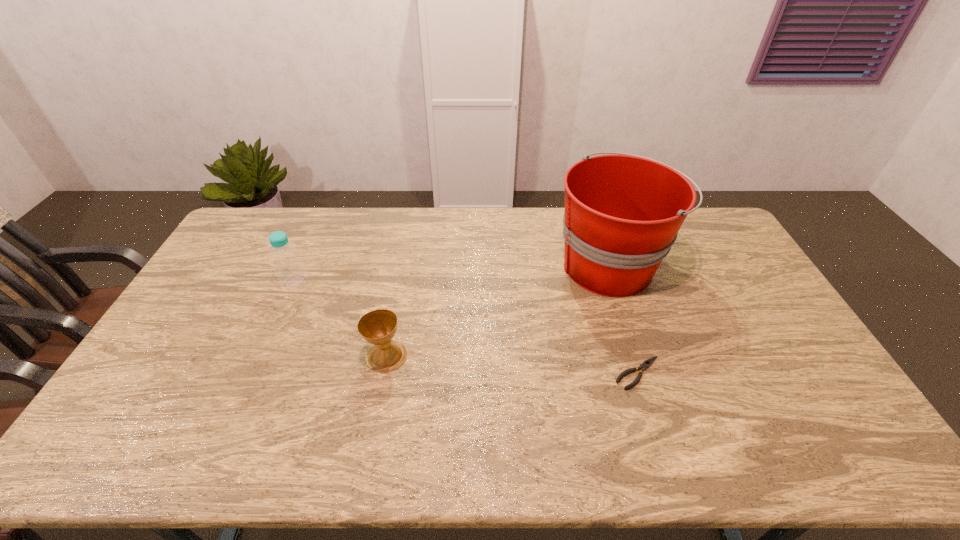
You are a GUI agent. You are given a task and a screenshot of the screen. Output one action in this format:
    pyautogui.click(x=<x>, y=<y>)
    Task: Click on the bucket
    Image resolution: width=960 pixels, height=540 pixels.
    Given the screenshot: What is the action you would take?
    pyautogui.click(x=623, y=212)

Where is `the leftmost object`? This screenshot has width=960, height=540. the leftmost object is located at coordinates (289, 268).

At what (x,y) coordinates should I click in order to perform the action: click on bottle. Please return your answer as a coordinate pair (x, y). The width and height of the screenshot is (960, 540). Looking at the image, I should click on (289, 268).

Locate an element on the screen. Image resolution: width=960 pixels, height=540 pixels. the third tallest object is located at coordinates (378, 327).

Image resolution: width=960 pixels, height=540 pixels. I want to click on the second object from left to right, so click(x=378, y=327).

What are the coordinates of `the shortest object` in the screenshot? It's located at (647, 363).

Where is `vacant area situated on the front of the tallest object`? The image size is (960, 540). vacant area situated on the front of the tallest object is located at coordinates (631, 329).

The height and width of the screenshot is (540, 960). What are the coordinates of `blank area located 0.190m on the right of the bottle` in the screenshot? It's located at (364, 282).

Locate an element on the screen. Image resolution: width=960 pixels, height=540 pixels. free space located on the right of the second object from left to right is located at coordinates (547, 356).

Where is `vacant space positioned on the back of the pliers`? This screenshot has width=960, height=540. vacant space positioned on the back of the pliers is located at coordinates (610, 281).